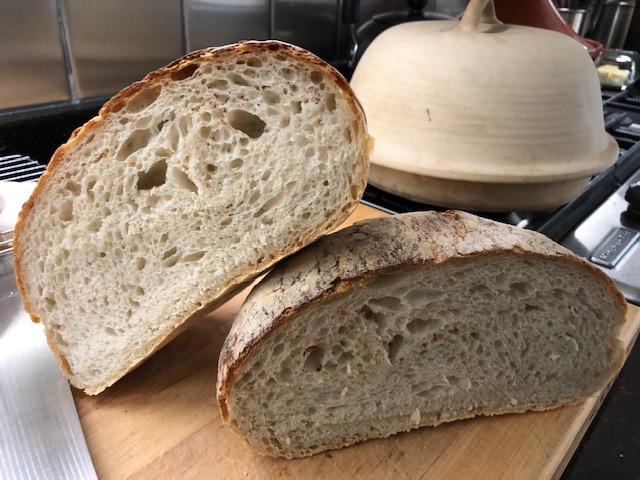
Image resolution: width=640 pixels, height=480 pixels. I want to click on table, so click(219, 451).